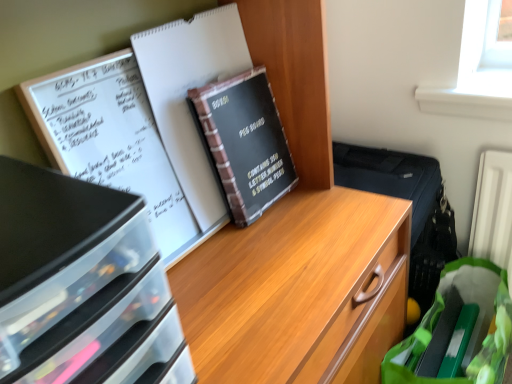
Question: From the image's perspective, is black paper journal at center located above black plastic drawers at left?

Choices:
 (A) yes
 (B) no

Answer: (A)

Question: Is black paper journal at center further to the viewer compared to black plastic drawers at left?

Choices:
 (A) no
 (B) yes

Answer: (B)

Question: From a real-world perspective, is black paper journal at center on top of black plastic drawers at left?

Choices:
 (A) yes
 (B) no

Answer: (A)

Question: Is black paper journal at center closer to the viewer compared to black plastic drawers at left?

Choices:
 (A) no
 (B) yes

Answer: (A)

Question: Can we say black paper journal at center lies outside black plastic drawers at left?

Choices:
 (A) yes
 (B) no

Answer: (A)

Question: From a real-world perspective, is black paper journal at center located beneath black plastic drawers at left?

Choices:
 (A) yes
 (B) no

Answer: (B)

Question: From the image's perspective, would you say black plastic drawers at left is positioned over green fabric grocery bag at lower right?

Choices:
 (A) yes
 (B) no

Answer: (A)

Question: From the image's perspective, is black plastic drawers at left below green fabric grocery bag at lower right?

Choices:
 (A) yes
 (B) no

Answer: (B)

Question: Is black plastic drawers at left thinner than green fabric grocery bag at lower right?

Choices:
 (A) no
 (B) yes

Answer: (A)

Question: Is black plastic drawers at left oriented towards green fabric grocery bag at lower right?

Choices:
 (A) no
 (B) yes

Answer: (A)

Question: Would you say black plastic drawers at left is outside green fabric grocery bag at lower right?

Choices:
 (A) no
 (B) yes

Answer: (B)

Question: Is there a large distance between black plastic drawers at left and green fabric grocery bag at lower right?

Choices:
 (A) no
 (B) yes

Answer: (A)

Question: Does black matte peg board at center have a greater width compared to green fabric grocery bag at lower right?

Choices:
 (A) no
 (B) yes

Answer: (A)